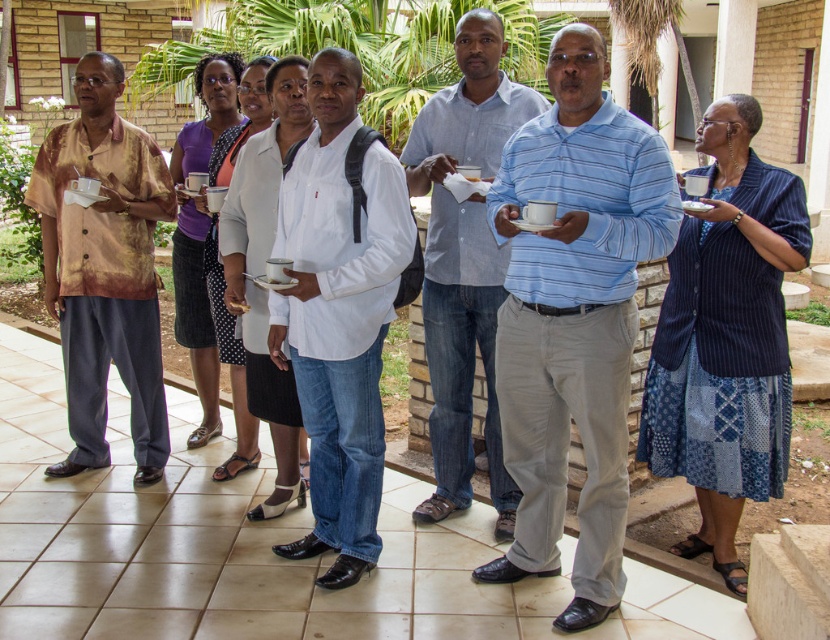
In the image of the group on the patio, where exactly is the matte brown shirt at left located in terms of coordinates?

The matte brown shirt at left is located at coordinates point (105, 268).

You are at a social event and want to introduce yourself to the person wearing the white matte shirt at center. Since you are standing next to the person wearing the matte brown shirt at left, should you move to your left or right to approach them?

You should move to your right to approach the white matte shirt at center because it is to the right of the matte brown shirt at left.

You are a photographer trying to capture a group photo of the matte brown shirt at left and the blue cotton shirt at center. The camera you are using has a maximum focus range of 5 feet. Can you fit both subjects within the camera frame without moving either of them?

The matte brown shirt at left and blue cotton shirt at center are 5.75 feet apart, which exceeds the camera maximum focus range of 5 feet. You need to move them closer to fit within the frame.